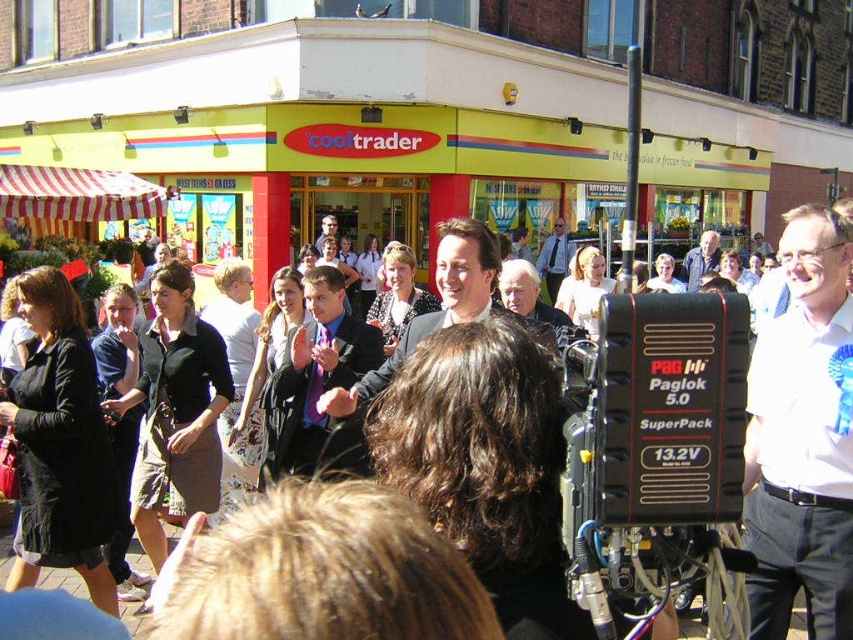
Is white shirt at center closer to the viewer compared to dark blue suit at center?

Yes, it is in front of dark blue suit at center.

Can you confirm if white shirt at center is positioned above dark blue suit at center?

Actually, white shirt at center is below dark blue suit at center.

Is point (780, 500) closer to camera compared to point (332, 218)?

Yes.

Where is `white shirt at center`? This screenshot has height=640, width=853. white shirt at center is located at coordinates (804, 436).

Does white shirt at center come behind blue shirt at center?

No, white shirt at center is closer to the viewer.

At what (x,y) coordinates should I click in order to perform the action: click on white shirt at center. Please return your answer as a coordinate pair (x, y). Image resolution: width=853 pixels, height=640 pixels. Looking at the image, I should click on (804, 436).

Which of these two, blue suit at center or blue shirt at center, stands taller?

blue suit at center is taller.

Between point (334, 282) and point (691, 262), which one is positioned behind?

The point (691, 262) is behind.

The height and width of the screenshot is (640, 853). Identify the location of blue suit at center. (317, 384).